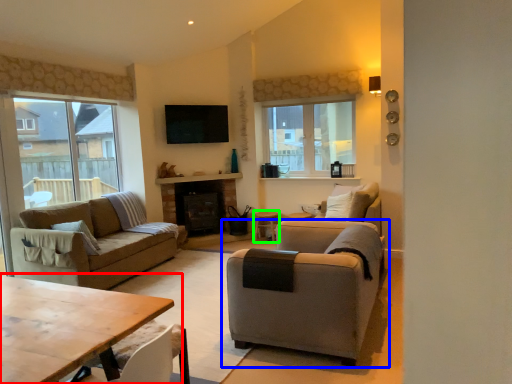
Question: Estimate the real-world distances between objects in this image. Which object is farther from table (highlighted by a red box), chair (highlighted by a blue box) or side table (highlighted by a green box)?

Choices:
 (A) chair
 (B) side table

Answer: (B)